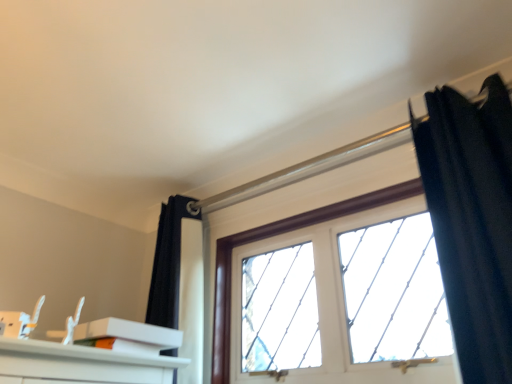
Question: Should I look upward or downward to see black velvet curtain at upper right?

Choices:
 (A) up
 (B) down

Answer: (B)

Question: Would you say black velvet curtain at upper right contains clear glass window at center?

Choices:
 (A) yes
 (B) no

Answer: (B)

Question: From the image's perspective, does black velvet curtain at upper right appear higher than clear glass window at center?

Choices:
 (A) yes
 (B) no

Answer: (A)

Question: Considering the relative sizes of black velvet curtain at upper right and clear glass window at center in the image provided, is black velvet curtain at upper right thinner than clear glass window at center?

Choices:
 (A) no
 (B) yes

Answer: (A)

Question: Is black velvet curtain at upper right not within clear glass window at center?

Choices:
 (A) yes
 (B) no

Answer: (A)

Question: Is black velvet curtain at upper right turned away from clear glass window at center?

Choices:
 (A) yes
 (B) no

Answer: (B)

Question: Is the position of black velvet curtain at upper right less distant than that of clear glass window at center?

Choices:
 (A) yes
 (B) no

Answer: (A)

Question: Is the depth of clear glass window at center less than that of black velvet curtain at upper right?

Choices:
 (A) no
 (B) yes

Answer: (A)

Question: Is clear glass window at center oriented towards black velvet curtain at upper right?

Choices:
 (A) no
 (B) yes

Answer: (A)

Question: Is clear glass window at center to the left of black velvet curtain at upper right from the viewer's perspective?

Choices:
 (A) yes
 (B) no

Answer: (A)

Question: Can you confirm if clear glass window at center is positioned to the right of black velvet curtain at upper right?

Choices:
 (A) no
 (B) yes

Answer: (A)

Question: From the image's perspective, is clear glass window at center beneath black velvet curtain at upper right?

Choices:
 (A) no
 (B) yes

Answer: (B)

Question: From a real-world perspective, is clear glass window at center under black velvet curtain at upper right?

Choices:
 (A) no
 (B) yes

Answer: (B)

Question: Is black velvet curtain at upper right next to white matte box at lower left and touching it?

Choices:
 (A) no
 (B) yes

Answer: (A)